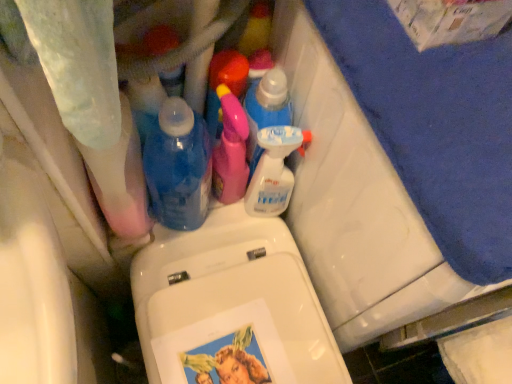
Question: In which direction should I rotate to look at pink plastic spray bottle at center, which ranks as the 4th cleaning product in right-to-left order?

Choices:
 (A) right
 (B) left

Answer: (B)

Question: Can you confirm if translucent plastic spray bottle at center, placed as the third cleaning product when sorted from left to right, is positioned to the left of transparent plastic bottle at center?

Choices:
 (A) yes
 (B) no

Answer: (B)

Question: Can you confirm if translucent plastic spray bottle at center, marked as the 2th cleaning product in a right-to-left arrangement, is shorter than transparent plastic bottle at center?

Choices:
 (A) yes
 (B) no

Answer: (A)

Question: From a real-world perspective, is translucent plastic spray bottle at center, marked as the 2th cleaning product in a right-to-left arrangement, beneath transparent plastic bottle at center?

Choices:
 (A) no
 (B) yes

Answer: (B)

Question: Does translucent plastic spray bottle at center, marked as the 2th cleaning product in a right-to-left arrangement, lie in front of transparent plastic bottle at center?

Choices:
 (A) no
 (B) yes

Answer: (A)

Question: Is translucent plastic spray bottle at center, marked as the 2th cleaning product in a right-to-left arrangement, behind transparent plastic bottle at center?

Choices:
 (A) yes
 (B) no

Answer: (A)

Question: Can you confirm if translucent plastic spray bottle at center, marked as the 2th cleaning product in a right-to-left arrangement, is smaller than transparent plastic bottle at center?

Choices:
 (A) no
 (B) yes

Answer: (B)

Question: Can you confirm if clear plastic spray bottle at upper center, which ranks as the first cleaning product in right-to-left order, is wider than blue fabric bath towel at upper right?

Choices:
 (A) no
 (B) yes

Answer: (A)

Question: Is clear plastic spray bottle at upper center, arranged as the 4th cleaning product when viewed from the left, not near blue fabric bath towel at upper right?

Choices:
 (A) yes
 (B) no

Answer: (B)

Question: Is clear plastic spray bottle at upper center, arranged as the 4th cleaning product when viewed from the left, positioned before blue fabric bath towel at upper right?

Choices:
 (A) no
 (B) yes

Answer: (A)

Question: From a real-world perspective, is clear plastic spray bottle at upper center, which ranks as the first cleaning product in right-to-left order, beneath blue fabric bath towel at upper right?

Choices:
 (A) yes
 (B) no

Answer: (B)

Question: Is the position of clear plastic spray bottle at upper center, arranged as the 4th cleaning product when viewed from the left, more distant than that of blue fabric bath towel at upper right?

Choices:
 (A) no
 (B) yes

Answer: (B)

Question: Is clear plastic spray bottle at upper center, which ranks as the first cleaning product in right-to-left order, at the right side of blue fabric bath towel at upper right?

Choices:
 (A) no
 (B) yes

Answer: (A)

Question: Does blue fabric bath towel at upper right come behind pink plastic spray bottle at center, which appears as the third cleaning product when viewed from the right?

Choices:
 (A) yes
 (B) no

Answer: (B)